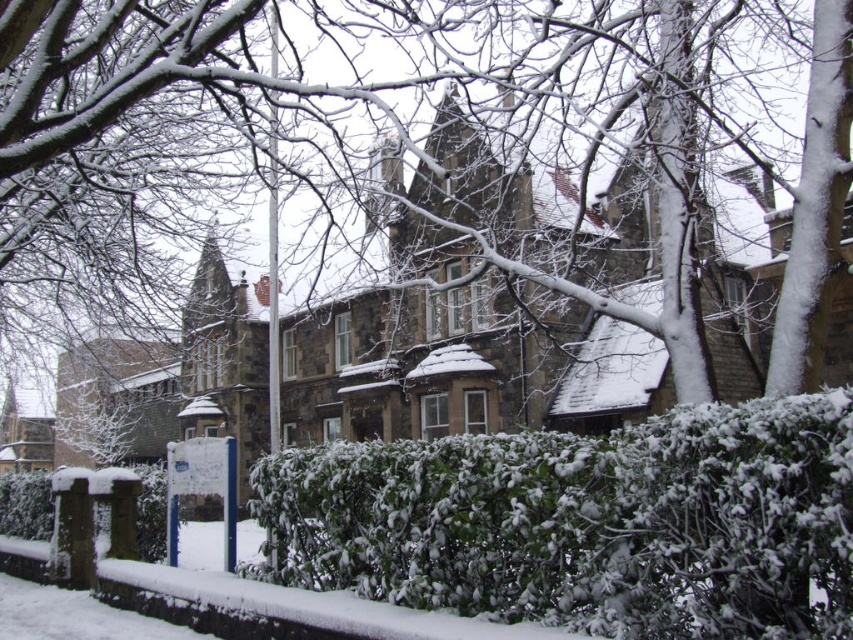
You are standing at point (473,116) in the winter scene. What do you see directly in front of you?

You see a snow covered tree at upper center directly in front of you at point (473,116).